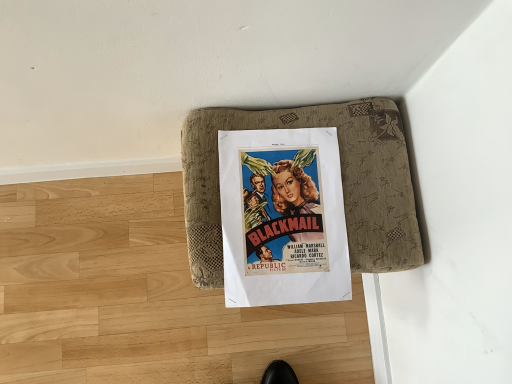
Find the location of a particular element. This screenshot has width=512, height=384. free space in front of matte paper poster at center is located at coordinates (255, 341).